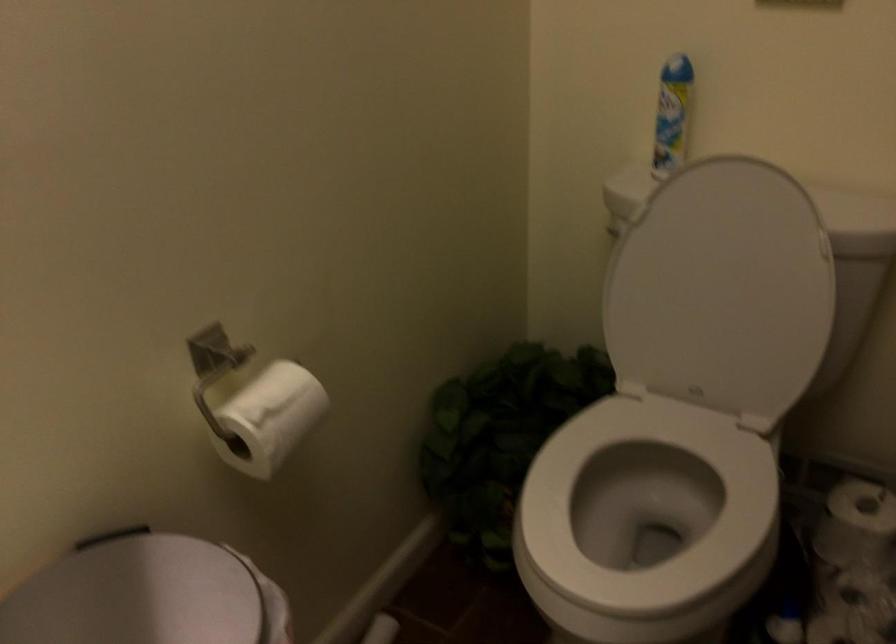
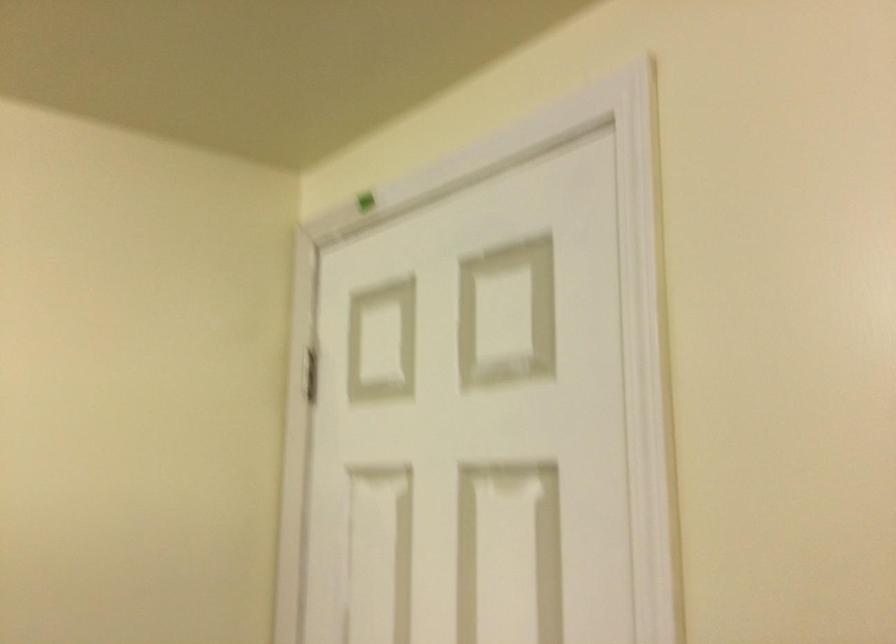
Question: The camera is either moving clockwise (left) or counter-clockwise (right) around the object. The first image is from the beginning of the video and the second image is from the end. Is the camera moving left or right when shooting the video?

Choices:
 (A) Left
 (B) Right

Answer: (B)